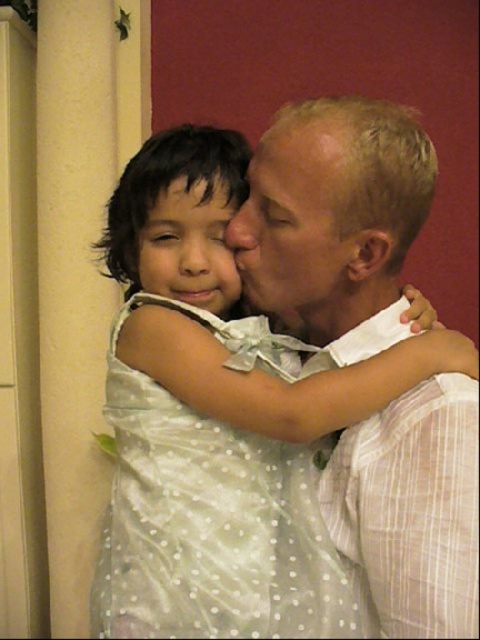
Question: Which object is closer to the camera taking this photo?

Choices:
 (A) matte white dress at center
 (B) white dotted dress at center

Answer: (B)

Question: Which object is closer to the camera taking this photo?

Choices:
 (A) smooth skin face at center
 (B) white dotted dress at center
 (C) matte white dress at center

Answer: (B)

Question: From the image, what is the correct spatial relationship of white dotted dress at center in relation to matte white dress at center?

Choices:
 (A) above
 (B) below

Answer: (B)

Question: Can you confirm if smooth skin face at center is positioned below matte white dress at center?

Choices:
 (A) no
 (B) yes

Answer: (B)

Question: Is white dotted dress at center closer to the viewer compared to matte white dress at center?

Choices:
 (A) yes
 (B) no

Answer: (A)

Question: Which object is farther from the camera taking this photo?

Choices:
 (A) white dotted dress at center
 (B) matte white dress at center

Answer: (B)